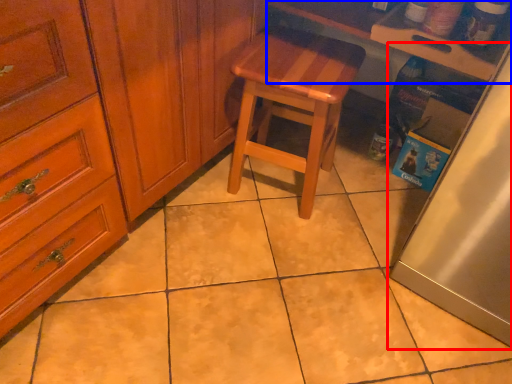
Question: Among these objects, which one is nearest to the camera, fridge (highlighted by a red box) or counter top (highlighted by a blue box)?

Choices:
 (A) fridge
 (B) counter top

Answer: (A)